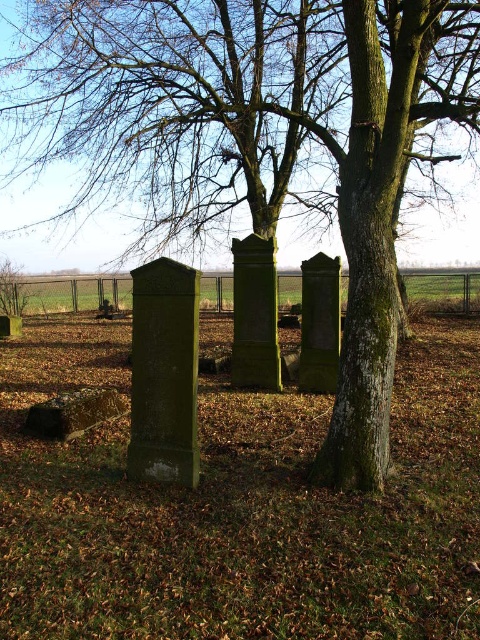
You are a gardener who needs to mow the lawn. You see the green grass at center and the smooth stone gravestone at lower left. Which area should you avoid mowing to prevent damaging the gravestone?

You should avoid mowing near the smooth stone gravestone at lower left because it is smaller in size compared to the green grass at center, making it easier to accidentally hit or damage during mowing.

You are standing at the origin point of the coordinate system in this cemetery scene. You want to walk to the green grass at center. What are the coordinates you should head towards?

The coordinates for the green grass at center are at point (64,296), so you should head towards those coordinates to reach it.

You are a gardener planning to mow the green grass at center and the smooth stone gravestone at lower left. Which area requires a wider mower path?

The green grass at center requires a wider mower path because it might be wider than the smooth stone gravestone at lower left.